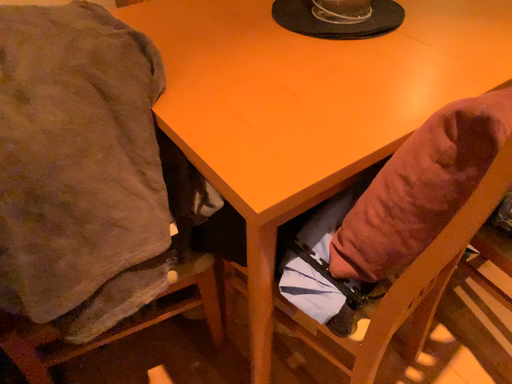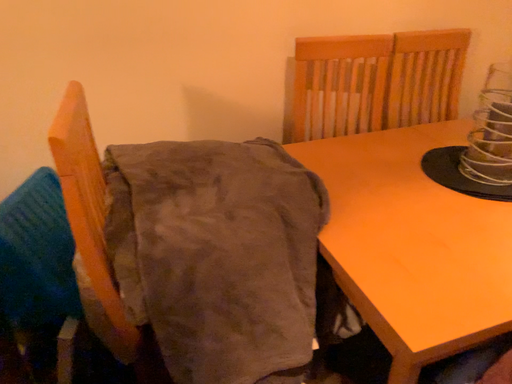
Question: How did the camera likely rotate when shooting the video?

Choices:
 (A) rotated upward
 (B) rotated downward

Answer: (A)